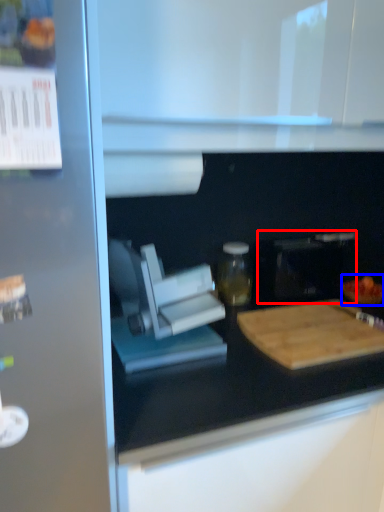
Question: Which object is closer to the camera taking this photo, appliance (highlighted by a red box) or food (highlighted by a blue box)?

Choices:
 (A) appliance
 (B) food

Answer: (A)